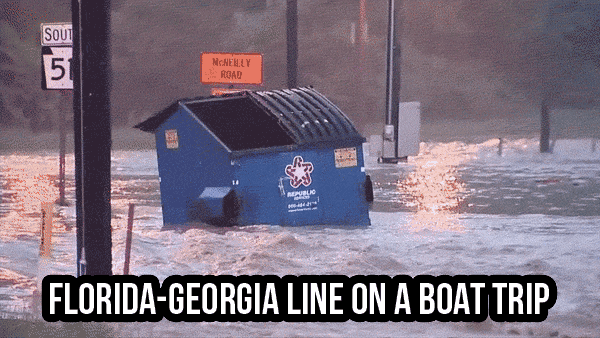
Locate an element on the screen. plastic door is located at coordinates 320,108.